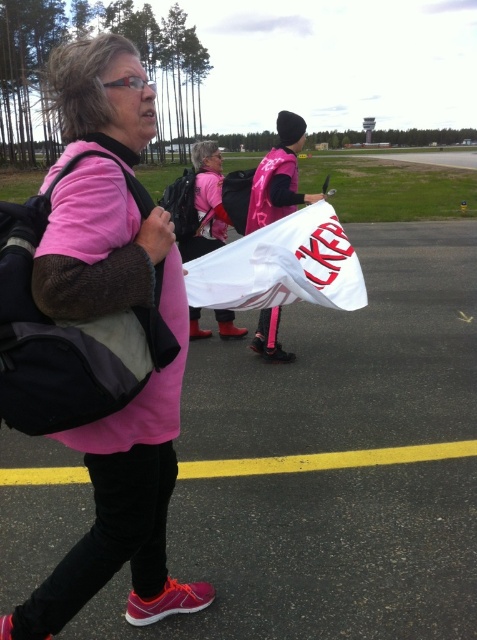
You are a photographer positioned at the far end of the path. You want to capture a photo that includes both the pink fabric shirt at center and the matte pink vest at center. Which object should you focus on first to ensure both are in frame?

The pink fabric shirt at center is much taller as matte pink vest at center, so you should focus on the pink fabric shirt at center first to ensure both are in frame.

You are a delivery drone that needs to fly between the black fabric backpack at left and the two people behind it. What is the minimum distance you should maintain to avoid collision?

The minimum distance you should maintain is 1.32 meters between the black fabric backpack at left and the two people behind it to avoid collision.